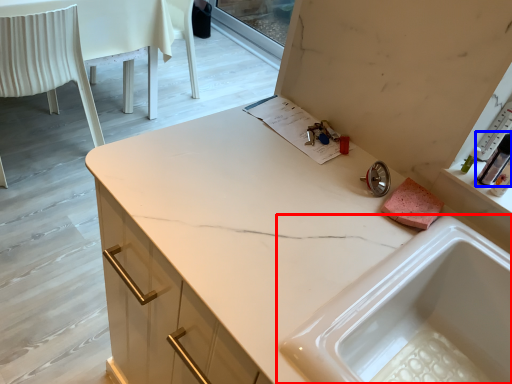
Question: Among these objects, which one is farthest to the camera, sink (highlighted by a red box) or toiletry (highlighted by a blue box)?

Choices:
 (A) sink
 (B) toiletry

Answer: (B)